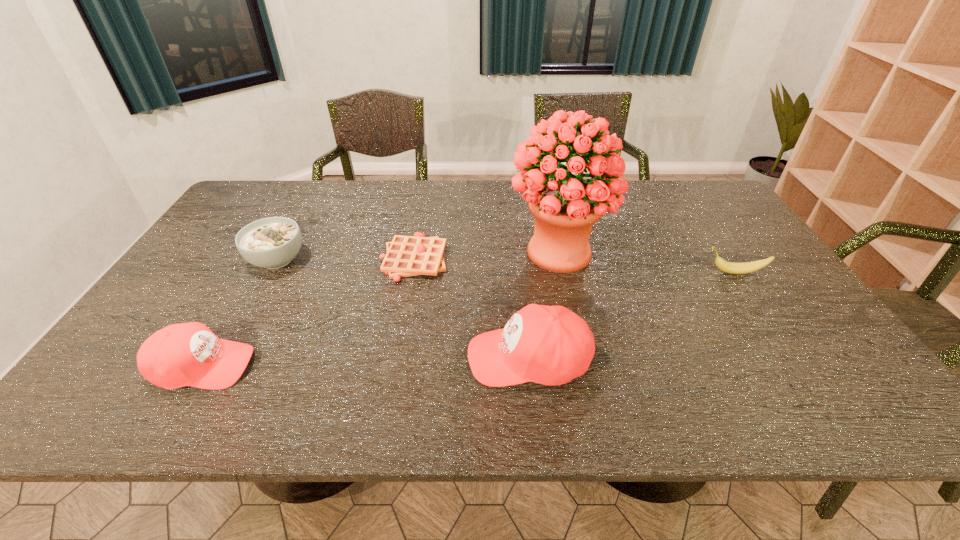
At what (x,y) coordinates should I click in order to perform the action: click on object that is at the right edge. Please return your answer as a coordinate pair (x, y). Looking at the image, I should click on (734, 268).

Locate an element on the screen. The image size is (960, 540). object present at the near left corner is located at coordinates (188, 354).

Find the location of a particular element. vacant space at the far edge is located at coordinates (485, 184).

In the image, there is a desktop. Where is `free space at the near edge`? Image resolution: width=960 pixels, height=540 pixels. free space at the near edge is located at coordinates (467, 370).

At what (x,y) coordinates should I click in order to perform the action: click on vacant area at the right edge of the desktop. Please return your answer as a coordinate pair (x, y). This screenshot has height=540, width=960. Looking at the image, I should click on [x=704, y=238].

Where is `vacant space at the near left corner`? vacant space at the near left corner is located at coordinates (135, 357).

This screenshot has height=540, width=960. In order to click on vacant space at the far right corner of the desktop in this screenshot , I will do `click(708, 198)`.

Find the location of a particular element. Image resolution: width=960 pixels, height=540 pixels. unoccupied area between the second tallest object and the banana is located at coordinates (632, 315).

Where is `free spot between the soup bowl and the left baseball cap`? free spot between the soup bowl and the left baseball cap is located at coordinates (240, 313).

Locate an element on the screen. Image resolution: width=960 pixels, height=540 pixels. free space that is in between the soup bowl and the fifth shortest object is located at coordinates (402, 309).